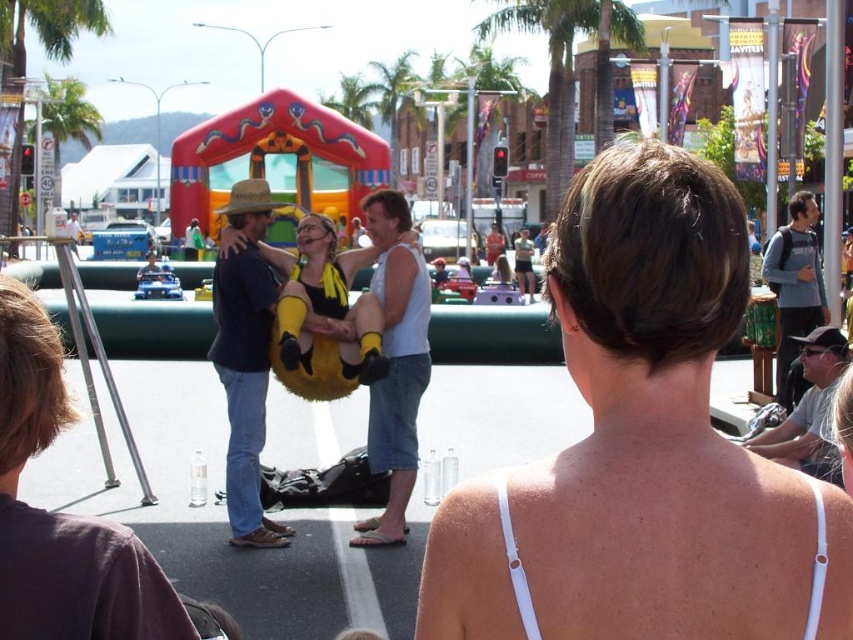
Who is taller, matte black shirt at center or white tank top at center?

With more height is matte black shirt at center.

Does matte black shirt at center have a lesser height compared to white tank top at center?

No, matte black shirt at center is not shorter than white tank top at center.

Does point (254, 433) come behind point (375, 269)?

No, (254, 433) is in front of (375, 269).

Where is `matte black shirt at center`? This screenshot has width=853, height=640. matte black shirt at center is located at coordinates (245, 360).

Between gray cotton hoodie at upper right and gray fabric cap at right, which one has more height?

With more height is gray cotton hoodie at upper right.

Is gray cotton hoodie at upper right taller than gray fabric cap at right?

Yes, gray cotton hoodie at upper right is taller than gray fabric cap at right.

Is point (779, 401) farther from camera compared to point (830, 378)?

Yes, point (779, 401) is behind point (830, 378).

You are a GUI agent. You are given a task and a screenshot of the screen. Output one action in this format:
    pyautogui.click(x=<x>, y=<y>)
    Task: Click on the gray cotton hoodie at upper right
    The width and height of the screenshot is (853, 640).
    Given the screenshot: What is the action you would take?
    pyautogui.click(x=793, y=285)

Does white fabric bikini top at upper center have a greater width compared to white tank top at center?

Yes, white fabric bikini top at upper center is wider than white tank top at center.

Who is lower down, white fabric bikini top at upper center or white tank top at center?

white tank top at center is below.

Which is in front, point (682, 616) or point (405, 476)?

Positioned in front is point (682, 616).

Locate an element on the screen. The height and width of the screenshot is (640, 853). white fabric bikini top at upper center is located at coordinates (642, 445).